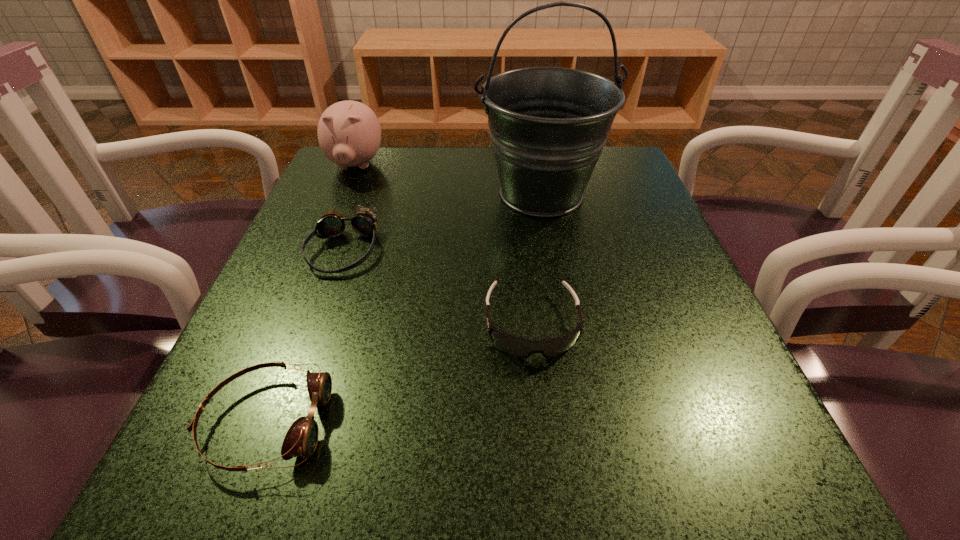
Find the location of a particular element. vacant region at the near edge of the desktop is located at coordinates (588, 471).

You are a GUI agent. You are given a task and a screenshot of the screen. Output one action in this format:
    pyautogui.click(x=<x>, y=<y>)
    Task: Click on the blank space at the left edge of the desktop
    Image resolution: width=960 pixels, height=540 pixels.
    Given the screenshot: What is the action you would take?
    pyautogui.click(x=326, y=318)

The image size is (960, 540). I want to click on free space at the right edge of the desktop, so click(588, 221).

This screenshot has width=960, height=540. In order to click on vacant area at the far left corner of the desktop in this screenshot , I will do `click(347, 198)`.

The width and height of the screenshot is (960, 540). What are the coordinates of `vacant area at the near left corner` in the screenshot? It's located at (203, 476).

Find the location of `free space that is in between the farthest goggles and the fourth farthest object`. free space that is in between the farthest goggles and the fourth farthest object is located at coordinates (438, 287).

What are the coordinates of `empty space between the fourth farthest object and the tallest object` in the screenshot? It's located at (537, 259).

Locate an element on the screen. This screenshot has width=960, height=540. free space between the farthest goggles and the second farthest goggles is located at coordinates (438, 287).

Where is `vacant space that is in between the second tallest object and the farthest goggles`? The height and width of the screenshot is (540, 960). vacant space that is in between the second tallest object and the farthest goggles is located at coordinates (349, 208).

Find the location of `free space between the bucket and the fourth shortest object`. free space between the bucket and the fourth shortest object is located at coordinates (448, 180).